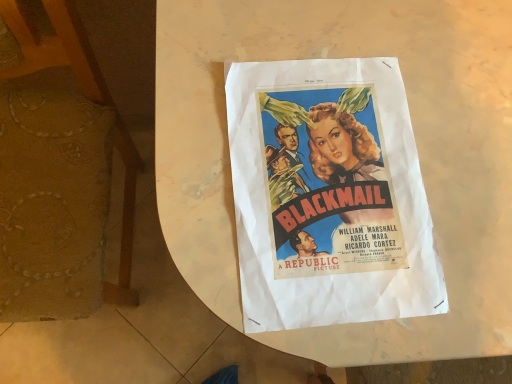
This screenshot has width=512, height=384. I want to click on unoccupied region to the right of matte paper poster at center, so click(x=467, y=216).